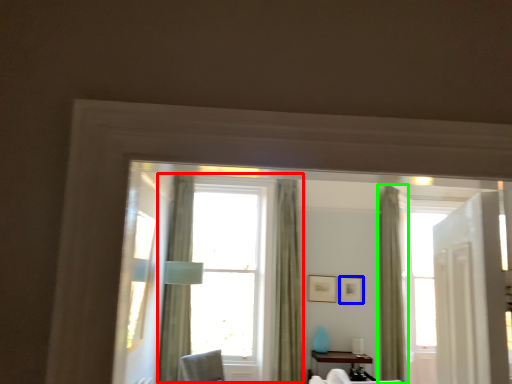
Question: Which is nearer to the window (highlighted by a red box)? picture frame (highlighted by a blue box) or curtain (highlighted by a green box).

Choices:
 (A) picture frame
 (B) curtain

Answer: (A)